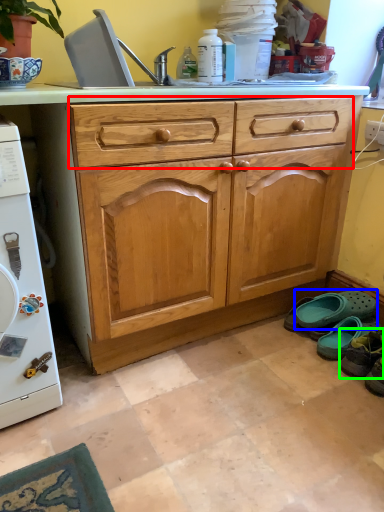
Question: Which object is the farthest from drawer (highlighted by a red box)? Choose among these: footwear (highlighted by a blue box) or footwear (highlighted by a green box).

Choices:
 (A) footwear
 (B) footwear

Answer: (B)